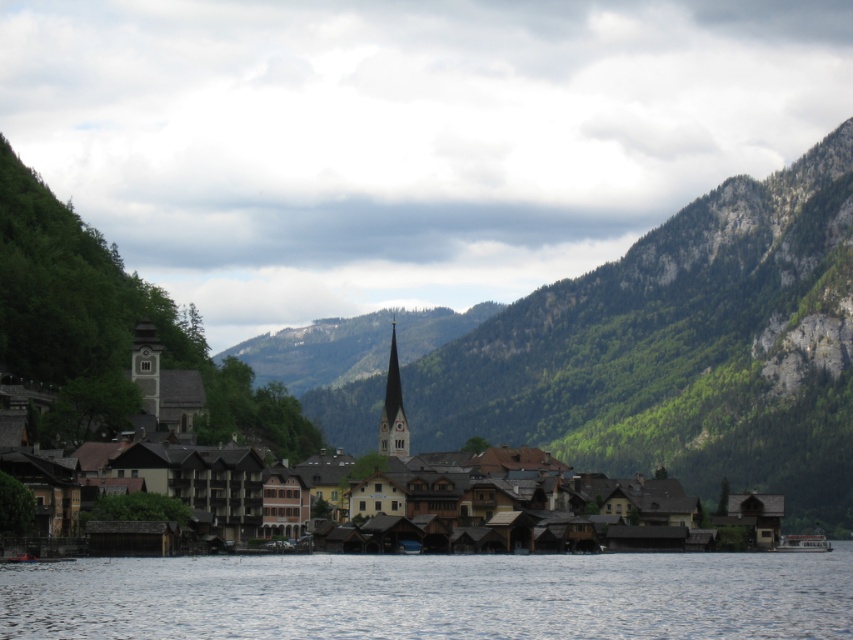
Question: Which point is closer to the camera taking this photo?

Choices:
 (A) (178, 385)
 (B) (395, 419)
 (C) (802, 544)

Answer: (A)

Question: Which of the following is the closest to the observer?

Choices:
 (A) green forested mountain at center
 (B) transparent water at lower center
 (C) smooth light brown spire at center
 (D) brown wooden houses at center

Answer: (B)

Question: Does brown wooden houses at center appear under smooth light brown spire at center?

Choices:
 (A) no
 (B) yes

Answer: (B)

Question: Which point is farther from the camera taking this photo?

Choices:
 (A) (386, 429)
 (B) (790, 545)
 (C) (351, 403)

Answer: (C)

Question: Does transparent water at lower center appear on the left side of smooth light brown spire at center?

Choices:
 (A) no
 (B) yes

Answer: (A)

Question: Does transparent water at lower center have a greater width compared to brown wooden houses at center?

Choices:
 (A) no
 (B) yes

Answer: (A)